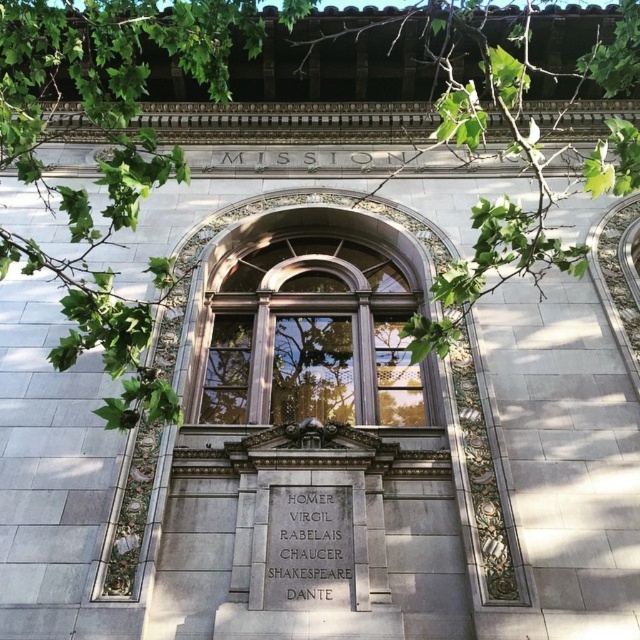
Question: Does green leafy branches at upper center have a greater width compared to gray stone plaque at center?

Choices:
 (A) no
 (B) yes

Answer: (B)

Question: Which object is positioned closest to the gray stone plaque at center?

Choices:
 (A) green leafy branches at upper center
 (B) wooden window at center

Answer: (B)

Question: Which object is positioned closest to the green leafy branches at upper center?

Choices:
 (A) gray stone plaque at center
 (B) wooden window at center

Answer: (B)

Question: Is wooden window at center to the right of gray stone plaque at center from the viewer's perspective?

Choices:
 (A) yes
 (B) no

Answer: (B)

Question: Can you confirm if green leafy branches at upper center is wider than gray stone plaque at center?

Choices:
 (A) yes
 (B) no

Answer: (A)

Question: Which object is closer to the camera taking this photo?

Choices:
 (A) gray stone plaque at center
 (B) green leafy branches at upper center

Answer: (B)